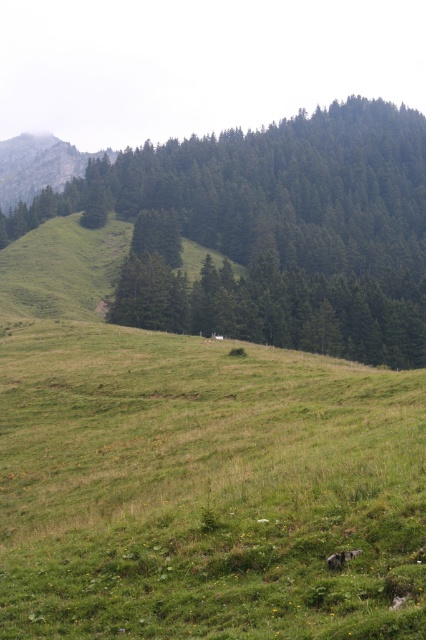
Which is more to the right, green leafy tree at center or rugged stone mountain at upper left?

Positioned to the right is green leafy tree at center.

What do you see at coordinates (275, 228) in the screenshot?
I see `green leafy tree at center` at bounding box center [275, 228].

Between point (319, 128) and point (31, 200), which one is positioned behind?

Point (31, 200)

Locate an element on the screen. The image size is (426, 640). green leafy tree at center is located at coordinates (275, 228).